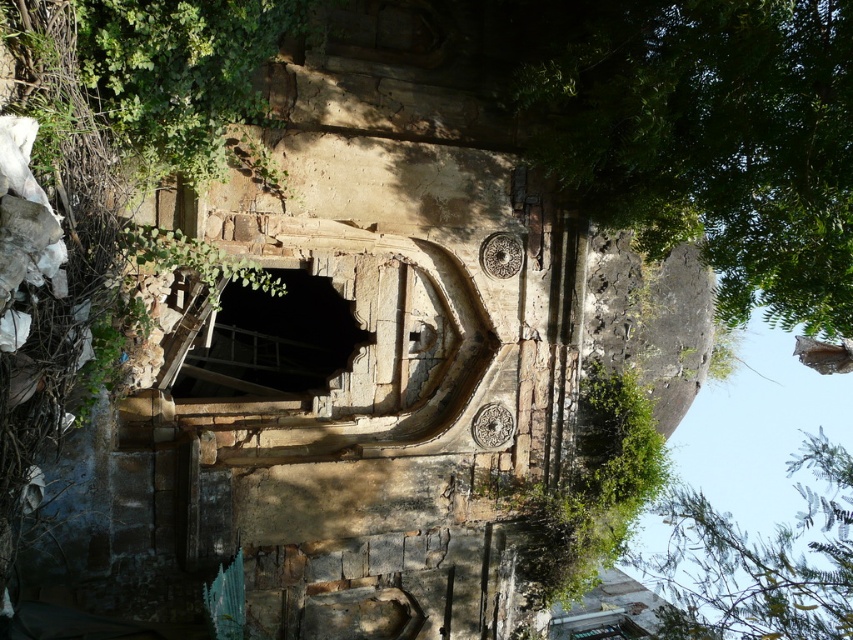
Question: Which object is closer to the camera taking this photo?

Choices:
 (A) green leafy tree at upper right
 (B) green leafy tree at lower right

Answer: (A)

Question: Can you confirm if green leafy tree at upper right is positioned below dark stone hole at center?

Choices:
 (A) yes
 (B) no

Answer: (B)

Question: Is green leafy tree at lower right bigger than dark stone hole at center?

Choices:
 (A) yes
 (B) no

Answer: (A)

Question: Which of these objects is positioned farthest from the green leafy tree at upper right?

Choices:
 (A) green leafy tree at lower right
 (B) dark stone hole at center

Answer: (A)

Question: Does green leafy tree at upper right lie behind dark stone hole at center?

Choices:
 (A) no
 (B) yes

Answer: (A)

Question: Which object is farther from the camera taking this photo?

Choices:
 (A) dark stone hole at center
 (B) green leafy tree at lower right

Answer: (B)